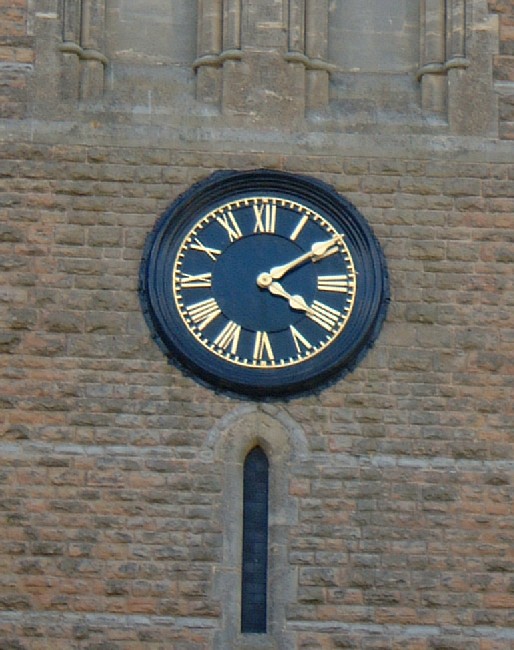
Where is `shorter hand of the clock`? This screenshot has height=650, width=514. shorter hand of the clock is located at coordinates (293, 299).